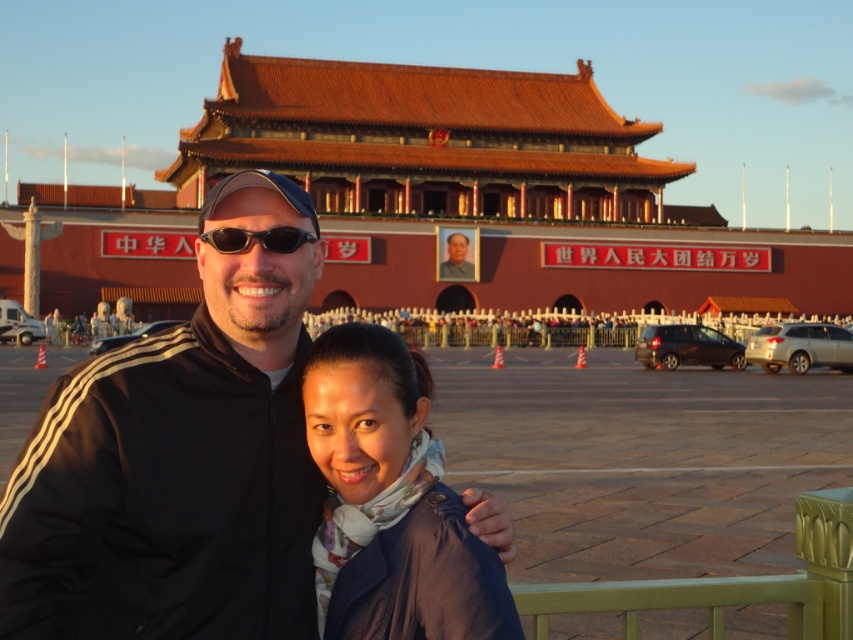
How much distance is there between reddish-brown tiled roof at center and blue fabric scarf at center?

reddish-brown tiled roof at center is 265.86 feet away from blue fabric scarf at center.

Is reddish-brown tiled roof at center to the right of blue fabric scarf at center from the viewer's perspective?

No, reddish-brown tiled roof at center is not to the right of blue fabric scarf at center.

Is point (634, 276) behind point (422, 458)?

Yes, it is.

Locate an element on the screen. This screenshot has height=640, width=853. reddish-brown tiled roof at center is located at coordinates (437, 200).

Is black fabric jacket at center wider than black plastic sunglasses at center?

Indeed, black fabric jacket at center has a greater width compared to black plastic sunglasses at center.

Who is higher up, black fabric jacket at center or black plastic sunglasses at center?

Positioned higher is black plastic sunglasses at center.

Between point (239, 189) and point (310, 232), which one is positioned behind?

The point (310, 232) is behind.

Locate an element on the screen. The image size is (853, 640). black fabric jacket at center is located at coordinates (178, 460).

Measure the distance between blue fabric scarf at center and camera.

48.12 feet

Is point (351, 440) closer to camera compared to point (467, 268)?

That is True.

The height and width of the screenshot is (640, 853). In order to click on blue fabric scarf at center in this screenshot , I will do `click(389, 500)`.